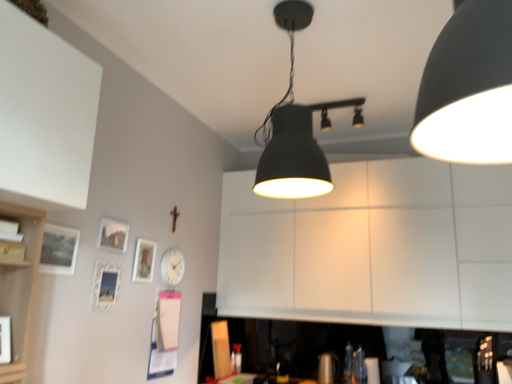
Question: Is clear plastic bottle at lower center outside of matte black lampshade at center, the second lamp positioned from the back?

Choices:
 (A) yes
 (B) no

Answer: (A)

Question: From a real-world perspective, is clear plastic bottle at lower center located higher than matte black lampshade at center, the second lamp positioned from the back?

Choices:
 (A) yes
 (B) no

Answer: (B)

Question: Does clear plastic bottle at lower center have a smaller size compared to matte black lampshade at center, the 1th lamp viewed from the left?

Choices:
 (A) yes
 (B) no

Answer: (A)

Question: Considering the relative positions of clear plastic bottle at lower center and matte black lampshade at center, the 1th lamp viewed from the left, in the image provided, is clear plastic bottle at lower center to the left of matte black lampshade at center, the 1th lamp viewed from the left, from the viewer's perspective?

Choices:
 (A) yes
 (B) no

Answer: (B)

Question: Considering the relative sizes of clear plastic bottle at lower center and matte black lampshade at center, acting as the 2th lamp starting from the right, in the image provided, is clear plastic bottle at lower center bigger than matte black lampshade at center, acting as the 2th lamp starting from the right,?

Choices:
 (A) no
 (B) yes

Answer: (A)

Question: From a real-world perspective, is matte black lampshade at center, positioned as the first lamp in front-to-back order, above or below white glossy picture frame at lower left, the second picture frame from the front?

Choices:
 (A) below
 (B) above

Answer: (B)

Question: Is point (322, 177) positioned closer to the camera than point (112, 264)?

Choices:
 (A) closer
 (B) farther

Answer: (A)

Question: From the image's perspective, relative to white glossy picture frame at lower left, acting as the third picture frame starting from the back, is matte black lampshade at center, acting as the 2th lamp starting from the right, above or below?

Choices:
 (A) below
 (B) above

Answer: (B)

Question: Considering the relative positions of matte black lampshade at center, the 1th lamp viewed from the left, and white glossy picture frame at lower left, acting as the third picture frame starting from the back, in the image provided, is matte black lampshade at center, the 1th lamp viewed from the left, to the left or to the right of white glossy picture frame at lower left, acting as the third picture frame starting from the back,?

Choices:
 (A) right
 (B) left

Answer: (A)

Question: From a real-world perspective, is matte glass picture frame at upper left, the fourth picture frame positioned from the front, physically located above or below matte black lampshade at center, positioned as the first lamp in front-to-back order?

Choices:
 (A) below
 (B) above

Answer: (A)

Question: Does point (146, 248) appear closer or farther from the camera than point (300, 137)?

Choices:
 (A) farther
 (B) closer

Answer: (A)

Question: From the image's perspective, is matte glass picture frame at upper left, the 1th picture frame in the back-to-front sequence, above or below matte black lampshade at center, positioned as the first lamp in front-to-back order?

Choices:
 (A) above
 (B) below

Answer: (B)

Question: In the image, is matte glass picture frame at upper left, the fourth picture frame positioned from the front, positioned in front of or behind matte black lampshade at center, the 1th lamp viewed from the left?

Choices:
 (A) behind
 (B) front

Answer: (A)

Question: Does point (472, 213) appear closer or farther from the camera than point (104, 230)?

Choices:
 (A) closer
 (B) farther

Answer: (B)

Question: Considering the positions of white matte cabinet at center and matte glass picture frame at lower left, placed as the 3th picture frame when sorted from front to back, in the image, is white matte cabinet at center wider or thinner than matte glass picture frame at lower left, placed as the 3th picture frame when sorted from front to back,?

Choices:
 (A) thin
 (B) wide

Answer: (B)